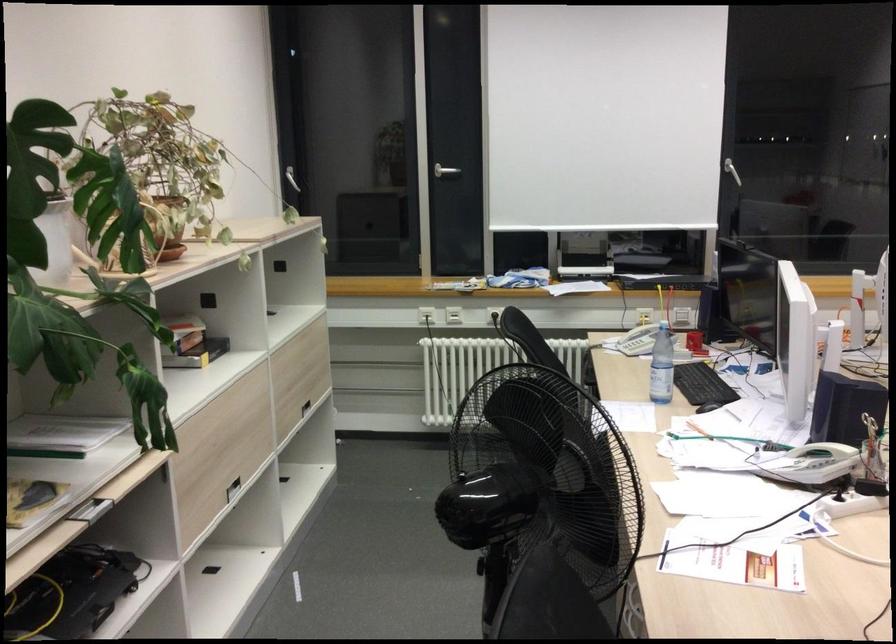
What do you see at coordinates (477, 368) in the screenshot?
I see `the radiator knob` at bounding box center [477, 368].